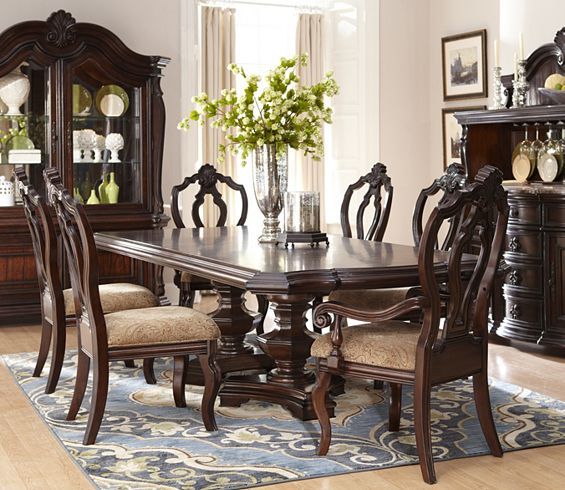
Locate an element on the screen. The width and height of the screenshot is (565, 490). chairs is located at coordinates (92, 285), (53, 261), (212, 179), (381, 178), (453, 176), (491, 187).